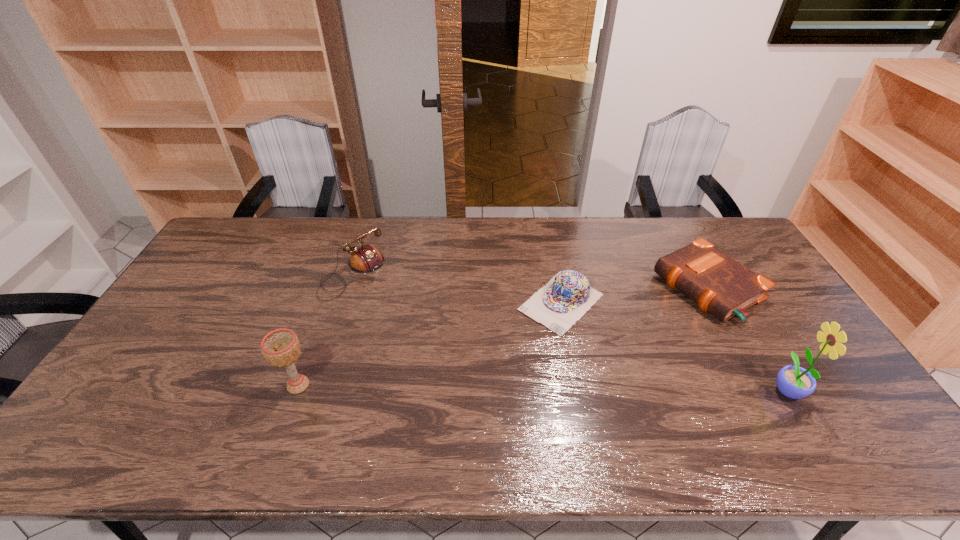
Identify the location of vacant space located 0.290m on the rotary dial of the telephone. The height and width of the screenshot is (540, 960). (428, 343).

At what (x,y) coordinates should I click in order to perform the action: click on vacant space located on the rotary dial of the telephone. Please return your answer as a coordinate pair (x, y). This screenshot has width=960, height=540. Looking at the image, I should click on (430, 345).

Where is `free space located on the rotary dial of the telephone`? This screenshot has height=540, width=960. free space located on the rotary dial of the telephone is located at coordinates (397, 318).

Locate an element on the screen. Image resolution: width=960 pixels, height=540 pixels. vacant space situated on the front, side, and top of the third object from right to left is located at coordinates (497, 363).

Find the location of a particular element. The height and width of the screenshot is (540, 960). free spot located on the front, side, and top of the third object from right to left is located at coordinates (524, 338).

Where is `blank space located on the front, side, and top of the third object from right to left`? blank space located on the front, side, and top of the third object from right to left is located at coordinates (491, 370).

Find the location of a particular element. Bible located in the far edge section of the desktop is located at coordinates (720, 285).

Where is `telephone at the far edge`? This screenshot has height=540, width=960. telephone at the far edge is located at coordinates (365, 259).

This screenshot has width=960, height=540. In order to click on chalice that is positioned at the near edge in this screenshot , I will do [x=281, y=347].

Where is `sunflower at the near edge`? This screenshot has width=960, height=540. sunflower at the near edge is located at coordinates (795, 382).